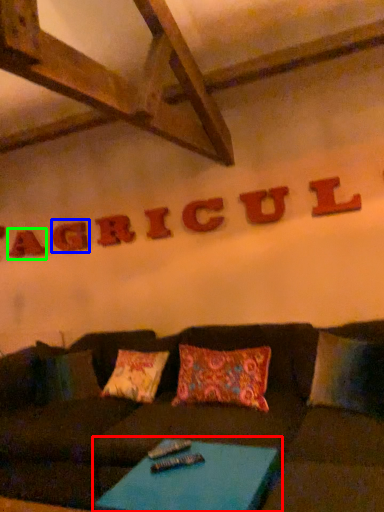
Question: Based on their relative distances, which object is nearer to table (highlighted by a red box)? Choose from letter (highlighted by a blue box) and letter (highlighted by a green box).

Choices:
 (A) letter
 (B) letter

Answer: (A)